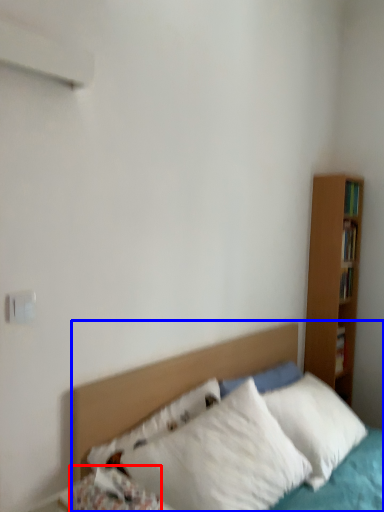
Question: Which object is further to the camera taking this photo, pillow (highlighted by a red box) or bed (highlighted by a blue box)?

Choices:
 (A) pillow
 (B) bed

Answer: (B)